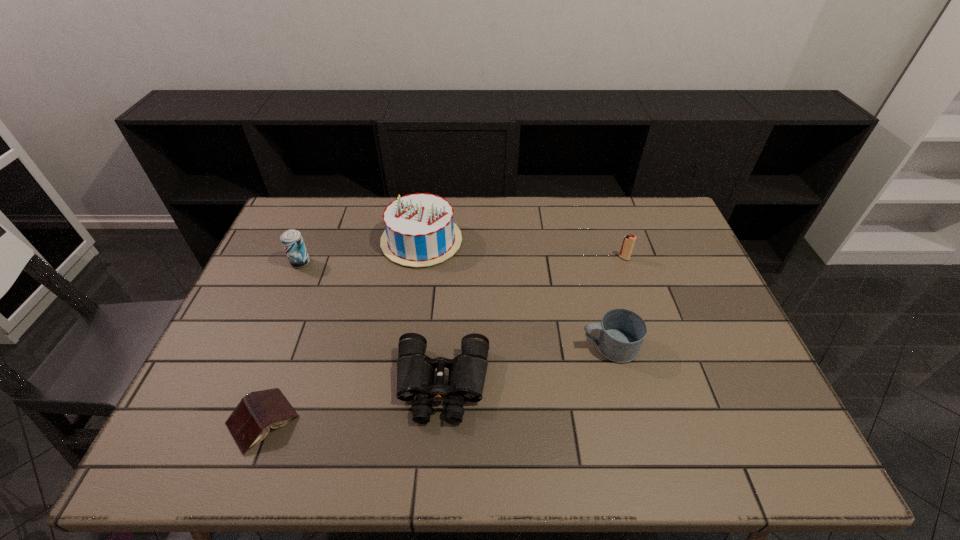
In order to click on vacant space at the near edge of the desktop in this screenshot , I will do `click(703, 432)`.

Locate an element on the screen. The width and height of the screenshot is (960, 540). vacant space at the left edge of the desktop is located at coordinates (256, 378).

Locate an element on the screen. The width and height of the screenshot is (960, 540). blank space at the right edge of the desktop is located at coordinates point(720,313).

Locate an element on the screen. free region at the far left corner of the desktop is located at coordinates (315, 207).

I want to click on free space at the near left corner of the desktop, so pos(234,451).

The height and width of the screenshot is (540, 960). Identify the location of vacant space in between the rightmost object and the mug. (x=616, y=302).

The height and width of the screenshot is (540, 960). Find the location of `free space between the shortest object and the beer can`. free space between the shortest object and the beer can is located at coordinates (281, 341).

I want to click on free space between the binoculars and the tallest object, so click(432, 313).

Identify the location of vacant region between the book and the beer can. The height and width of the screenshot is (540, 960). (281, 341).

Locate an element on the screen. The height and width of the screenshot is (540, 960). free space between the book and the igniter is located at coordinates (444, 339).